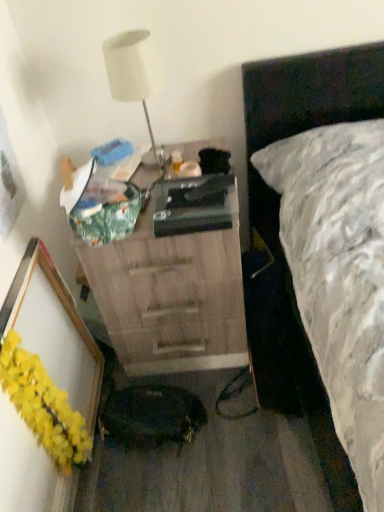
Where is `vacant area that lies in front of wooden chest of drawers at center`? The width and height of the screenshot is (384, 512). vacant area that lies in front of wooden chest of drawers at center is located at coordinates (220, 449).